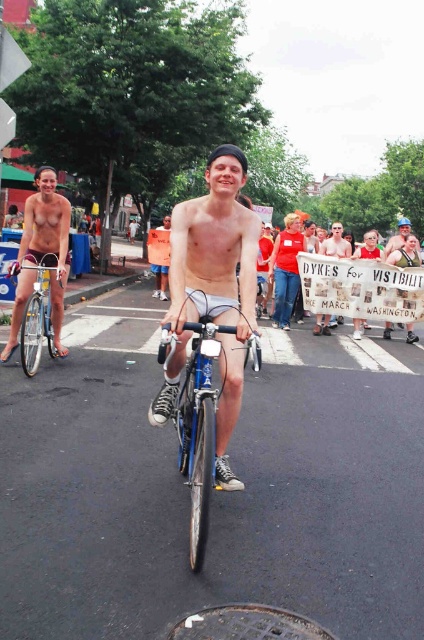
Question: From the image, what is the correct spatial relationship of matte white sign at center in relation to blue hard plastic helmet at center?

Choices:
 (A) right
 (B) left

Answer: (B)

Question: Which point is closer to the camera taking this photo?

Choices:
 (A) (406, 218)
 (B) (25, 337)
 (C) (346, 256)
 (D) (38, 234)

Answer: (B)

Question: Can you confirm if matte white sign at center is positioned to the left of orange cotton shorts at center?

Choices:
 (A) yes
 (B) no

Answer: (B)

Question: Estimate the real-world distances between objects in this image. Which object is closer to the blue hard plastic helmet at center?

Choices:
 (A) orange cotton shorts at center
 (B) gray metallic manhole cover at lower center

Answer: (B)

Question: Is matte white sign at center to the left of blue hard plastic helmet at center from the viewer's perspective?

Choices:
 (A) yes
 (B) no

Answer: (A)

Question: Which of these objects is positioned farthest from the shiny blue frame at center?

Choices:
 (A) shiny silver bicycle at center
 (B) matte white sign at center

Answer: (B)